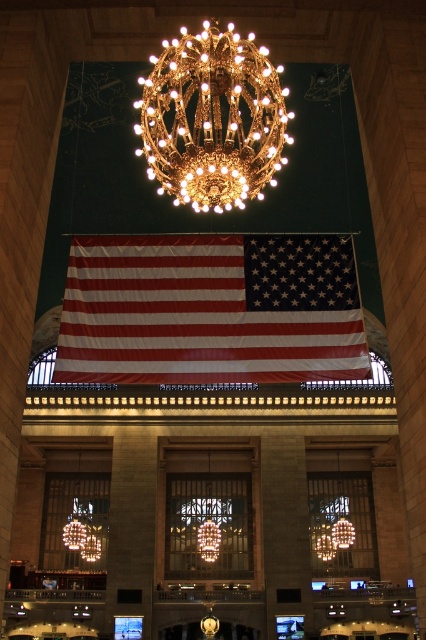
Question: Which object appears farthest from the camera in this image?

Choices:
 (A) matte fabric flag at center
 (B) gold metallic chandelier at upper center

Answer: (A)

Question: Can you confirm if matte fabric flag at center is positioned above gold metallic chandelier at upper center?

Choices:
 (A) yes
 (B) no

Answer: (B)

Question: Does matte fabric flag at center appear on the right side of gold metallic chandelier at upper center?

Choices:
 (A) yes
 (B) no

Answer: (A)

Question: Is the position of matte fabric flag at center less distant than that of gold metallic chandelier at upper center?

Choices:
 (A) yes
 (B) no

Answer: (B)